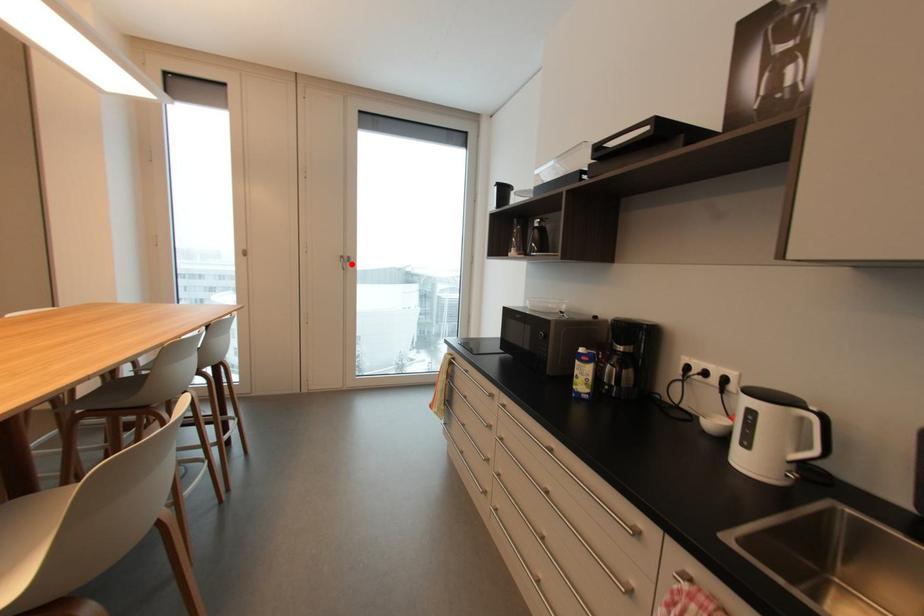
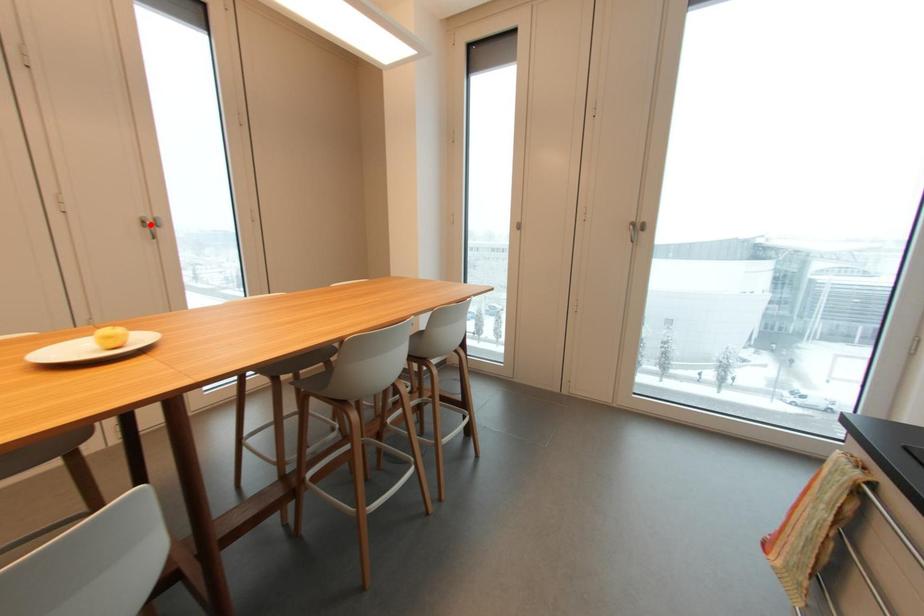
I am providing you with two images of the same scene from different viewpoints. A red point is marked on the first image and another point is marked on the second image. Are the points marked in image1 and image2 representing the same 3D position?

No